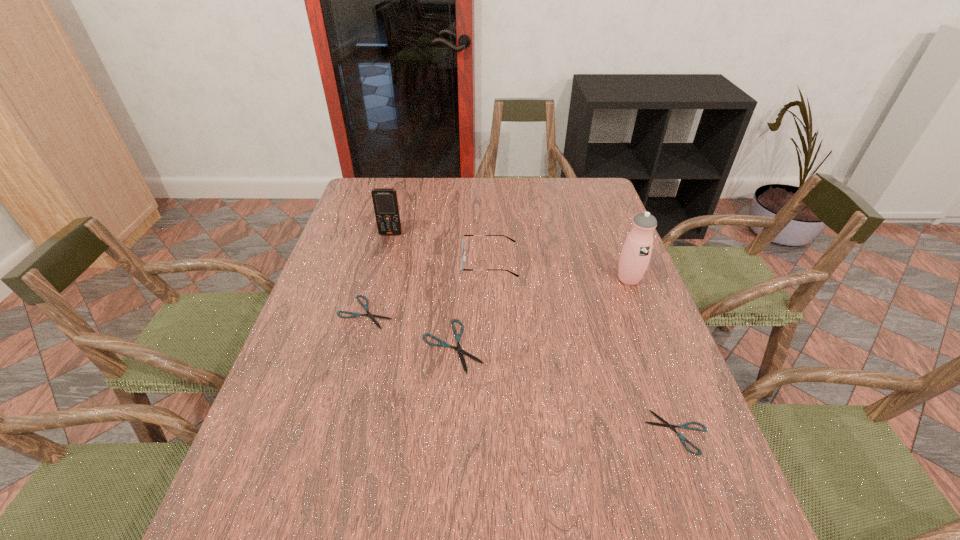
At what (x,y) coordinates should I click in order to perform the action: click on the leftmost shears. Please return your answer as a coordinate pair (x, y). The height and width of the screenshot is (540, 960). Looking at the image, I should click on (371, 316).

The height and width of the screenshot is (540, 960). Find the location of `the second shortest object`. the second shortest object is located at coordinates (371, 316).

Where is `the second shears from left to right`? The image size is (960, 540). the second shears from left to right is located at coordinates (442, 344).

Find the location of `the shortest object`. the shortest object is located at coordinates (685, 426).

You are a GUI agent. You are given a task and a screenshot of the screen. Output one action in this format:
    pyautogui.click(x=<x>, y=<y>)
    Task: Click on the nearest object
    Image resolution: width=960 pixels, height=540 pixels.
    Given the screenshot: What is the action you would take?
    pyautogui.click(x=685, y=426)

Image resolution: width=960 pixels, height=540 pixels. Find the location of `thermos bottle`. thermos bottle is located at coordinates (636, 252).

Find the location of `the fourth shortest object`. the fourth shortest object is located at coordinates (463, 258).

Where is `the farthest object`? This screenshot has width=960, height=540. the farthest object is located at coordinates (385, 201).

The height and width of the screenshot is (540, 960). In order to click on the fifth shortest object in this screenshot , I will do `click(385, 201)`.

I want to click on vacant space positioned on the front of the second tallest shears, so (x=331, y=440).